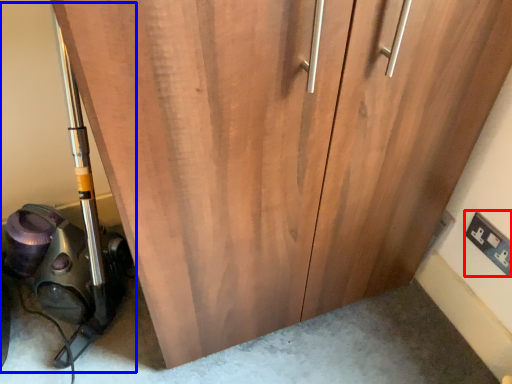
Question: Among these objects, which one is nearest to the camera, electric outlet (highlighted by a red box) or equipment (highlighted by a blue box)?

Choices:
 (A) electric outlet
 (B) equipment

Answer: (B)